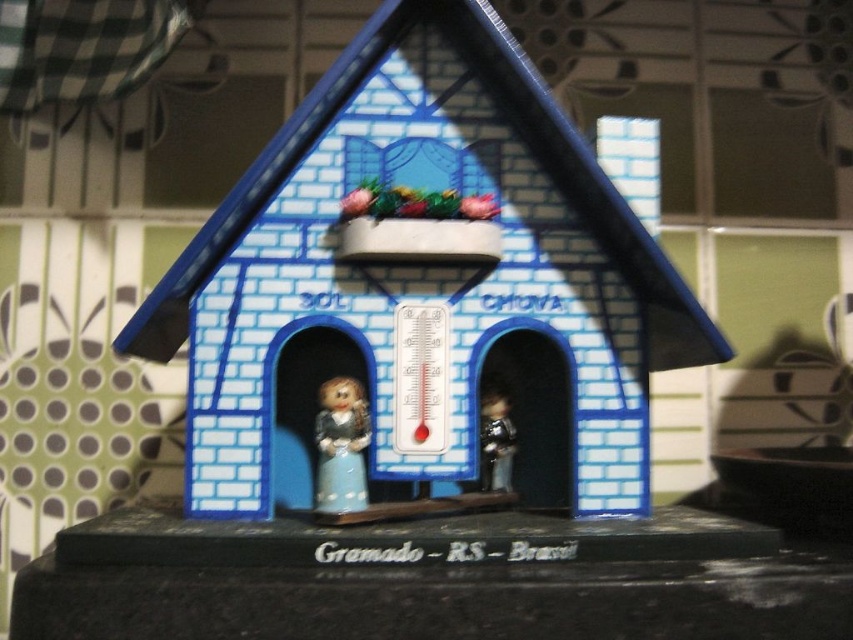
Question: Which object is farther from the camera taking this photo?

Choices:
 (A) metallic silver figurine at center
 (B) matte porcelain doll at lower left

Answer: (A)

Question: Which point is farther from the camera taking this photo?

Choices:
 (A) (485, 410)
 (B) (424, 234)
 (C) (332, 500)

Answer: (A)

Question: Does blue painted wood thermometer at center appear on the left side of matte porcelain doll at lower left?

Choices:
 (A) no
 (B) yes

Answer: (A)

Question: Does matte porcelain doll at lower left appear over metallic silver figurine at center?

Choices:
 (A) yes
 (B) no

Answer: (A)

Question: Is blue painted wood thermometer at center positioned in front of matte porcelain doll at lower left?

Choices:
 (A) no
 (B) yes

Answer: (A)

Question: Which of the following is the closest to the observer?

Choices:
 (A) [x=366, y=433]
 (B) [x=433, y=164]
 (C) [x=485, y=490]

Answer: (A)